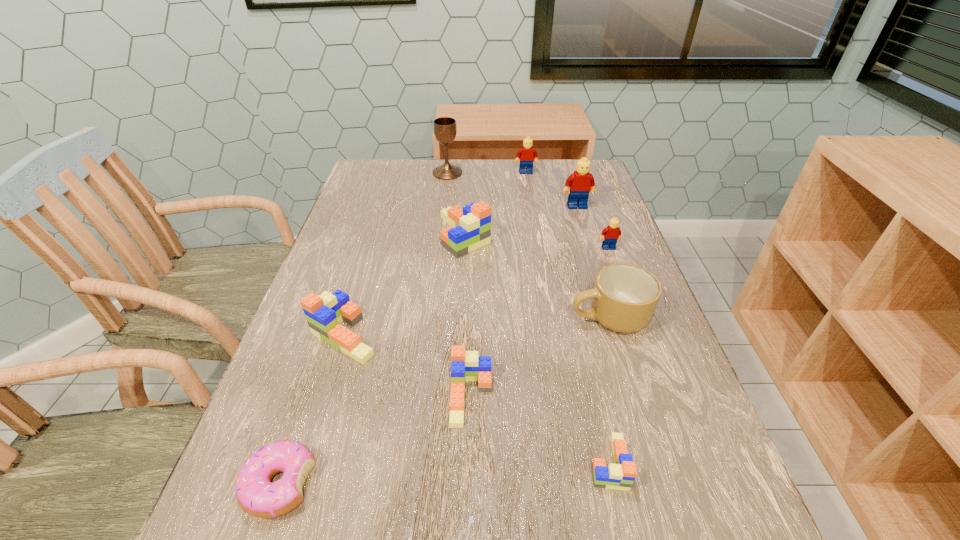
You are a GUI agent. You are given a task and a screenshot of the screen. Output one action in this format:
    pyautogui.click(x=<x>, y=<y>)
    Task: Click on the unoccupied position between the eighth farthest object and the chalice
    This screenshot has width=960, height=540.
    Given the screenshot: What is the action you would take?
    pyautogui.click(x=460, y=285)

Locate an element on the screen. This screenshot has height=540, width=960. free space that is in between the nearest orange Lego and the pink doughnut is located at coordinates (444, 473).

Where is `free area in between the tan mug and the second shortest Lego`? This screenshot has height=540, width=960. free area in between the tan mug and the second shortest Lego is located at coordinates (540, 357).

The height and width of the screenshot is (540, 960). Find the location of `unoccupied area between the second shortest Lego and the second biggest orange Lego`. unoccupied area between the second shortest Lego and the second biggest orange Lego is located at coordinates click(408, 366).

Where is `blank region between the tan mug and the leftmost yellow Lego`? The image size is (960, 540). blank region between the tan mug and the leftmost yellow Lego is located at coordinates (567, 245).

This screenshot has height=540, width=960. Identify the location of free area in between the second nearest Lego and the nearest yellow Lego. (540, 323).

Locate an element on the screen. vacant space in between the nearest Lego and the smallest yellow Lego is located at coordinates (609, 355).

Locate which object ranks eighth in proximity to the sixth nearest Lego. Please provide its 2D coordinates. Your answer should be formatted as a tuple, i.e. [(x, y)], where the tuple contains the x and y coordinates of a point satisfying the conditions above.

[(620, 476)]

Where is `the fifth closest object to the leftmost yellow Lego`? The image size is (960, 540). the fifth closest object to the leftmost yellow Lego is located at coordinates (624, 298).

In order to click on the fifth closest Lego to the biggest orange Lego in this screenshot , I will do `click(465, 365)`.